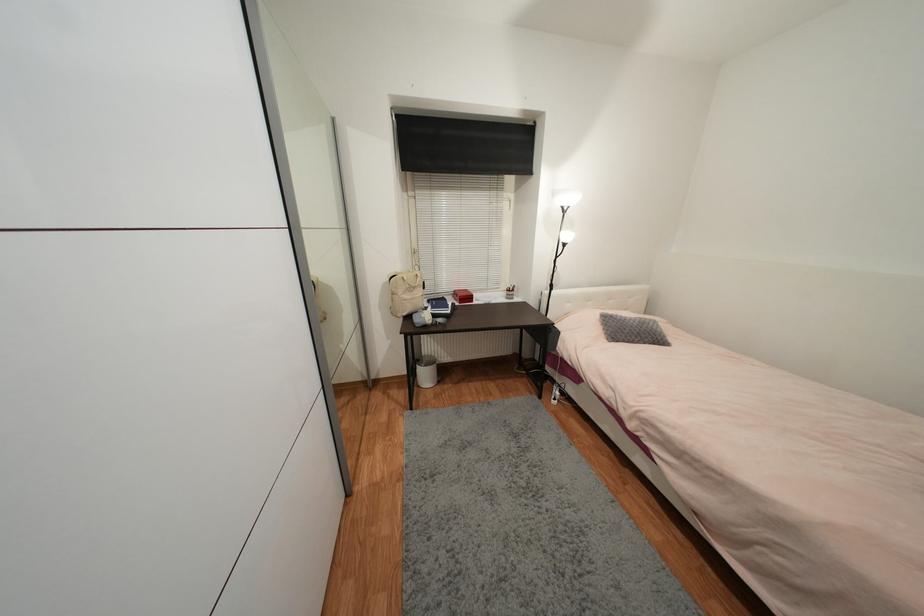
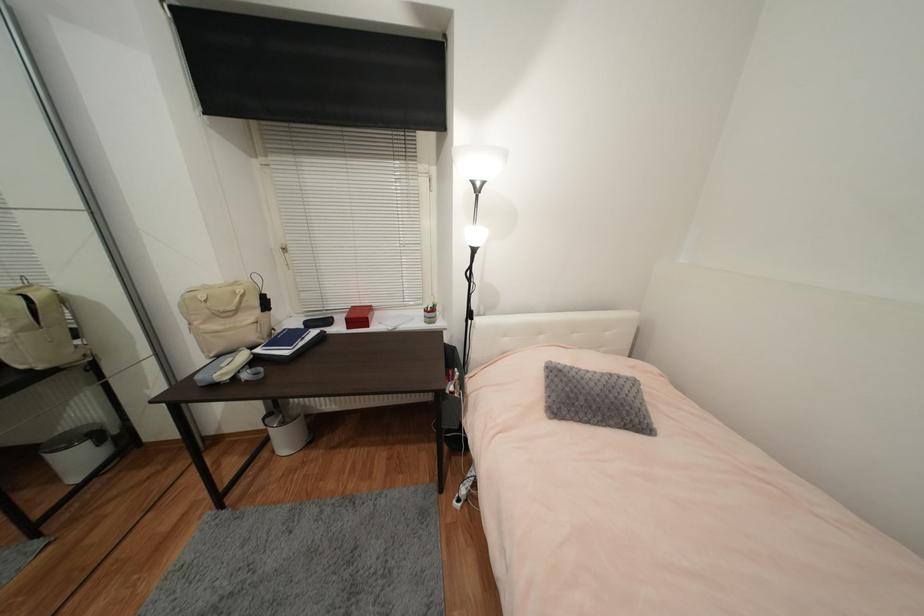
Where in the second image is the point corresponding to the point at 639,326 from the first image?

(602, 391)